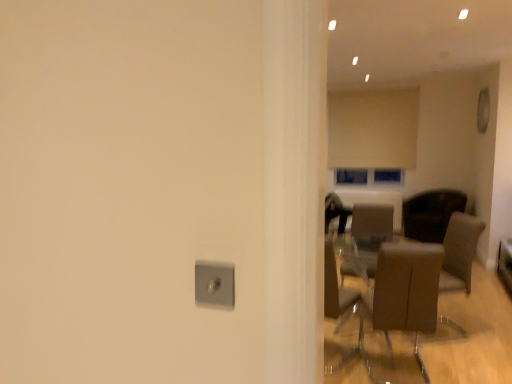
Describe the element at coordinates (351, 176) in the screenshot. I see `clear glass window at center` at that location.

At what (x,y) coordinates should I click in order to perform the action: click on white textured radiator at center. Please return your answer as a coordinate pair (x, y). The height and width of the screenshot is (384, 512). Looking at the image, I should click on (374, 200).

Describe the element at coordinates (371, 231) in the screenshot. The width and height of the screenshot is (512, 384). I see `brown leather chair at center, which appears as the second chair when viewed from the back` at that location.

You are a GUI agent. You are given a task and a screenshot of the screen. Output one action in this format:
    pyautogui.click(x=<x>, y=<y>)
    Task: Click on the brown leather chair at center-right, the third chair from the front
    The width and height of the screenshot is (512, 384).
    Given the screenshot: What is the action you would take?
    pyautogui.click(x=431, y=214)

What is the approximate width of satin silver outlet at center?

satin silver outlet at center is 1.19 inches in width.

Find the location of a particular element. This screenshot has height=384, width=512. brown leather chair at center, which appears as the 1th chair when viewed from the left is located at coordinates (402, 306).

From the image's perspective, between satin silver outlet at center and beige fabric curtain at upper center, who is located below?

Result: satin silver outlet at center.

Does satin silver outlet at center touch beige fabric curtain at upper center?

There is a gap between satin silver outlet at center and beige fabric curtain at upper center.

Is satin silver outlet at center oriented away from beige fabric curtain at upper center?

Absolutely, satin silver outlet at center is directed away from beige fabric curtain at upper center.

Between point (215, 273) and point (357, 122), which one is positioned behind?

Point (357, 122)

How much distance is there between clear glass window at center and brown leather chair at center, which is counted as the 3th chair, starting from the back?

The distance of clear glass window at center from brown leather chair at center, which is counted as the 3th chair, starting from the back, is 3.54 meters.

Between point (340, 169) and point (372, 308), which one is positioned in front?

Positioned in front is point (372, 308).

Is clear glass window at center oriented away from brown leather chair at center, arranged as the third chair when viewed from the right?

No, brown leather chair at center, arranged as the third chair when viewed from the right, is not at the back of clear glass window at center.

Would you say brown leather chair at center, the first chair from the front, is part of clear glass window at center's contents?

No, brown leather chair at center, the first chair from the front, is located outside of clear glass window at center.

Image resolution: width=512 pixels, height=384 pixels. Identify the location of the 1st chair counting from the left side of the white textured radiator at center. (371, 231).

In the scene shown: Can you confirm if brown leather chair at center, which ranks as the 2th chair in left-to-right order, is taller than white textured radiator at center?

Correct, brown leather chair at center, which ranks as the 2th chair in left-to-right order, is much taller as white textured radiator at center.

Does brown leather chair at center, placed as the 2th chair when sorted from right to left, touch white textured radiator at center?

No, brown leather chair at center, placed as the 2th chair when sorted from right to left, is not next to white textured radiator at center.

Considering the sizes of objects brown leather chair at center-right, which appears as the first chair when viewed from the back, and beige fabric curtain at upper center in the image provided, who is smaller, brown leather chair at center-right, which appears as the first chair when viewed from the back, or beige fabric curtain at upper center?

Smaller between the two is beige fabric curtain at upper center.

Is brown leather chair at center-right, which appears as the first chair when viewed from the back, facing towards beige fabric curtain at upper center?

No, brown leather chair at center-right, which appears as the first chair when viewed from the back, is not oriented towards beige fabric curtain at upper center.

Between brown leather chair at center-right, the third chair from the front, and beige fabric curtain at upper center, which one appears on the right side from the viewer's perspective?

brown leather chair at center-right, the third chair from the front.

How distant is brown leather chair at center, which appears as the second chair when viewed from the back, from clear glass window at center?

A distance of 2.06 meters exists between brown leather chair at center, which appears as the second chair when viewed from the back, and clear glass window at center.

Can you tell me how much brown leather chair at center, which appears as the second chair when viewed from the back, and clear glass window at center differ in facing direction?

0.656 degrees separate the facing orientations of brown leather chair at center, which appears as the second chair when viewed from the back, and clear glass window at center.

Is brown leather chair at center, which appears as the second chair when viewed from the back, oriented towards clear glass window at center?

No, brown leather chair at center, which appears as the second chair when viewed from the back, is not facing towards clear glass window at center.

Where is `window positioned vertically above the brown leather chair at center, acting as the second chair starting from the front (from a real-world perspective)`? The image size is (512, 384). window positioned vertically above the brown leather chair at center, acting as the second chair starting from the front (from a real-world perspective) is located at coordinates (351, 176).

From a real-world perspective, is brown leather chair at center, the first chair from the front, physically above clear glass window at center?

No.

Is brown leather chair at center, the first chair from the front, touching clear glass window at center?

brown leather chair at center, the first chair from the front, and clear glass window at center are not in contact.

From the image's perspective, starting from the clear glass window at center, which chair is the 3rd one below? Please provide its 2D coordinates.

[(402, 306)]

Which object is thinner, brown leather chair at center, which is counted as the 3th chair, starting from the back, or clear glass window at center?

clear glass window at center is thinner.

From the image's perspective, does brown leather chair at center, arranged as the third chair when viewed from the right, appear lower than brown leather chair at center, acting as the second chair starting from the front?

Yes, from the image's perspective, brown leather chair at center, arranged as the third chair when viewed from the right, is below brown leather chair at center, acting as the second chair starting from the front.

Considering the sizes of brown leather chair at center, which is counted as the 3th chair, starting from the back, and brown leather chair at center, which appears as the second chair when viewed from the back, in the image, is brown leather chair at center, which is counted as the 3th chair, starting from the back, taller or shorter than brown leather chair at center, which appears as the second chair when viewed from the back,?

Considering their sizes, brown leather chair at center, which is counted as the 3th chair, starting from the back, has more height than brown leather chair at center, which appears as the second chair when viewed from the back.

Is brown leather chair at center, which appears as the second chair when viewed from the back, surrounded by brown leather chair at center, arranged as the third chair when viewed from the right?

That's incorrect, brown leather chair at center, which appears as the second chair when viewed from the back, is not inside brown leather chair at center, arranged as the third chair when viewed from the right.

Find the location of a particular element. Image resolution: width=512 pixels, height=384 pixels. chair below the brown leather chair at center, which ranks as the 2th chair in left-to-right order (from the image's perspective) is located at coordinates (402, 306).

Locate an element on the screen. electric outlet in front of the beige fabric curtain at upper center is located at coordinates (214, 284).

Image resolution: width=512 pixels, height=384 pixels. I want to click on window above the brown leather chair at center, which appears as the 1th chair when viewed from the left (from the image's perspective), so click(x=351, y=176).

From the image, which object appears to be nearer to brown fabric armchair at right, white textured radiator at center or clear glass window at center?

white textured radiator at center lies closer to brown fabric armchair at right than the other object.

From the image, which object appears to be nearer to brown leather chair at center, acting as the second chair starting from the front, clear glass window at center or brown fabric armchair at right?

The object closer to brown leather chair at center, acting as the second chair starting from the front, is brown fabric armchair at right.

Estimate the real-world distances between objects in this image. Which object is closer to brown leather chair at center-right, which is the 3th chair from left to right, brown leather chair at center, placed as the 2th chair when sorted from right to left, or satin silver outlet at center?

Among the two, brown leather chair at center, placed as the 2th chair when sorted from right to left, is located nearer to brown leather chair at center-right, which is the 3th chair from left to right.

Which object lies nearer to the anchor point clear glass window at center, beige fabric curtain at upper center or brown leather chair at center-right, which ranks as the 1th chair in right-to-left order?

Among the two, beige fabric curtain at upper center is located nearer to clear glass window at center.

Based on their spatial positions, is brown leather chair at center, which appears as the second chair when viewed from the back, or beige fabric curtain at upper center closer to brown fabric armchair at right?

brown leather chair at center, which appears as the second chair when viewed from the back, lies closer to brown fabric armchair at right than the other object.

Based on their spatial positions, is white textured radiator at center or clear glass window at center further from satin silver outlet at center?

clear glass window at center lies further to satin silver outlet at center than the other object.

Looking at the image, which one is located closer to brown leather chair at center-right, which is the 3th chair from left to right, brown fabric armchair at right or beige fabric curtain at upper center?

The object closer to brown leather chair at center-right, which is the 3th chair from left to right, is beige fabric curtain at upper center.

Looking at the image, which one is located closer to beige fabric curtain at upper center, brown fabric armchair at right or satin silver outlet at center?

Among the two, brown fabric armchair at right is located nearer to beige fabric curtain at upper center.

The width and height of the screenshot is (512, 384). In order to click on window between beige fabric curtain at upper center and brown leather chair at center-right, the third chair from the front, in the up-down direction in this screenshot , I will do `click(351, 176)`.

Where is `curtain between brown leather chair at center, which is counted as the 3th chair, starting from the back, and white textured radiator at center, along the z-axis`? The width and height of the screenshot is (512, 384). curtain between brown leather chair at center, which is counted as the 3th chair, starting from the back, and white textured radiator at center, along the z-axis is located at coordinates (373, 129).

Locate an element on the screen. The image size is (512, 384). curtain positioned between brown fabric armchair at right and white textured radiator at center from near to far is located at coordinates (373, 129).

Where is `curtain located between brown leather chair at center, arranged as the third chair when viewed from the right, and clear glass window at center in the depth direction`? The width and height of the screenshot is (512, 384). curtain located between brown leather chair at center, arranged as the third chair when viewed from the right, and clear glass window at center in the depth direction is located at coordinates (373, 129).